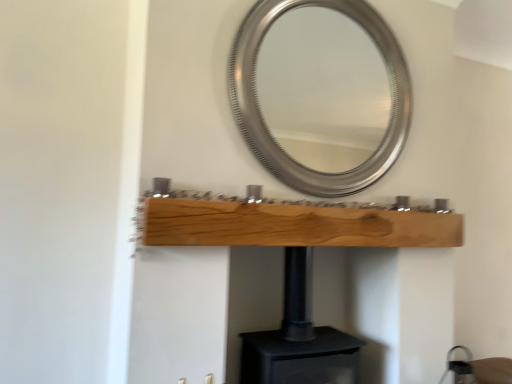
Question: Does point 150,218 appear closer or farther from the camera than point 276,336?

Choices:
 (A) closer
 (B) farther

Answer: (A)

Question: In the image, is natural wood plank at center positioned in front of or behind black matte fireplace at center?

Choices:
 (A) behind
 (B) front

Answer: (B)

Question: Estimate the real-world distances between objects in this image. Which object is farther from the black matte fireplace at center?

Choices:
 (A) silver metallic mirror at upper center
 (B) natural wood plank at center

Answer: (A)

Question: Based on their relative distances, which object is farther from the natural wood plank at center?

Choices:
 (A) silver metallic mirror at upper center
 (B) black matte fireplace at center

Answer: (A)